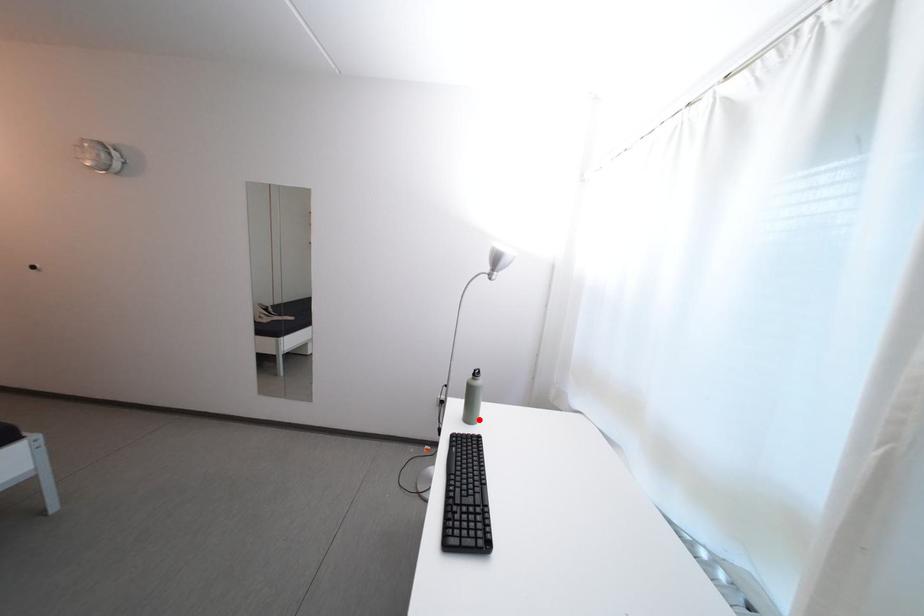
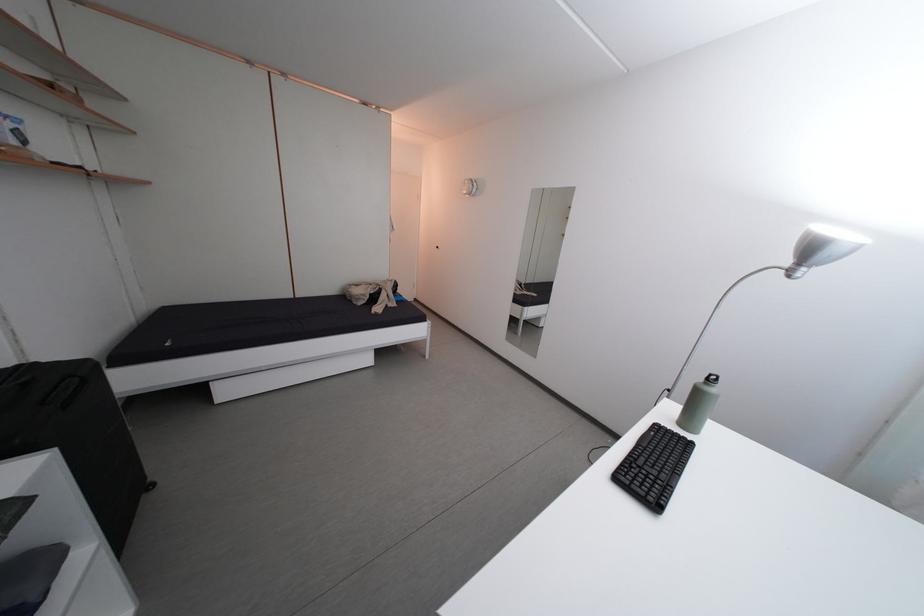
Find the pixel in the second image that matches the highlighted location in the first image.

(699, 427)